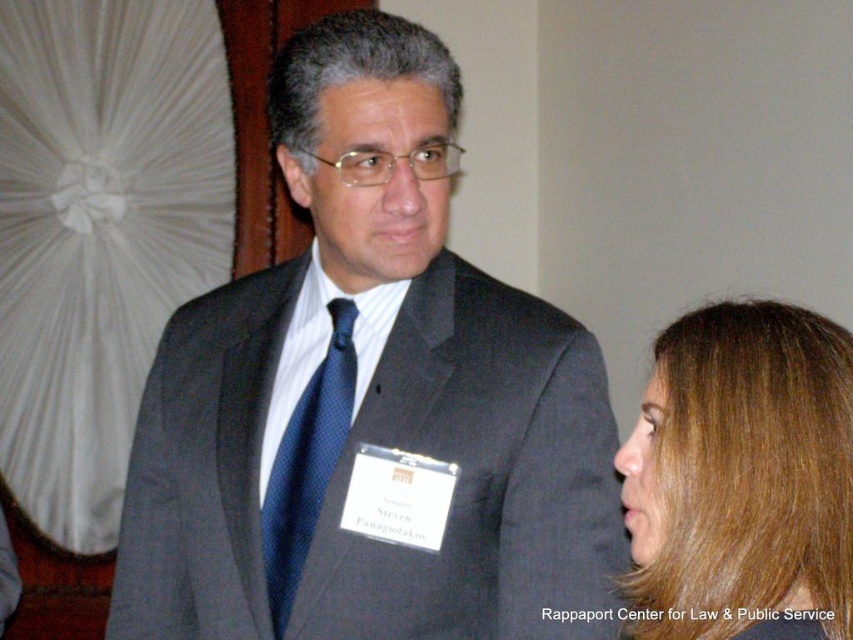
You are organizing a formal event and need to ensure that all guests can comfortably wear their attire without overlapping. Given the image of the matte black suit at center and the blue dotted tie at center, which item has a greater width and would require more space?

The matte black suit at center has a greater width than the blue dotted tie at center, so it would require more space.

You are a photographer at an event and need to adjust the focus of your camera to capture both Steven Panagiotakos and the person with brown hair at right clearly. The camera has a depth of field that can cover objects within 30 inches from each other. Can you focus on both subjects without adjusting your position?

The brown hair at right is 29.83 inches away from the camera. Since the depth of field can cover objects within 30 inches from each other, focusing on both Steven Panagiotakos and the brown hair at right is possible without adjusting your position.

You are standing at the point labeled point [318,49]. You want to move to the other side of the room, which is 3 meters away from your current position. If you walk straight ahead, will you reach the other side before encountering either of the two people in the image?

The two people are 1.23 meters apart, so if you walk straight ahead, you will encounter them before reaching the other side of the room, which is 3 meters away.